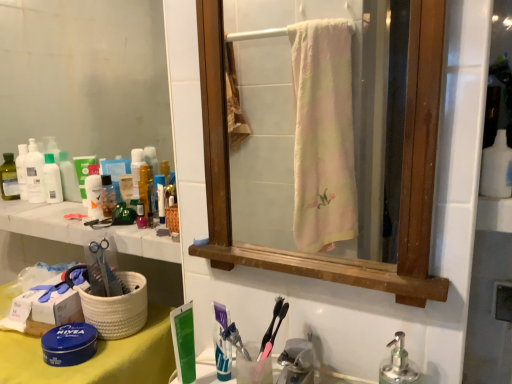
Image resolution: width=512 pixels, height=384 pixels. Find the location of `vacant space in front of matte white lotion at left, the second toiletry viewed from the left`. vacant space in front of matte white lotion at left, the second toiletry viewed from the left is located at coordinates (41, 209).